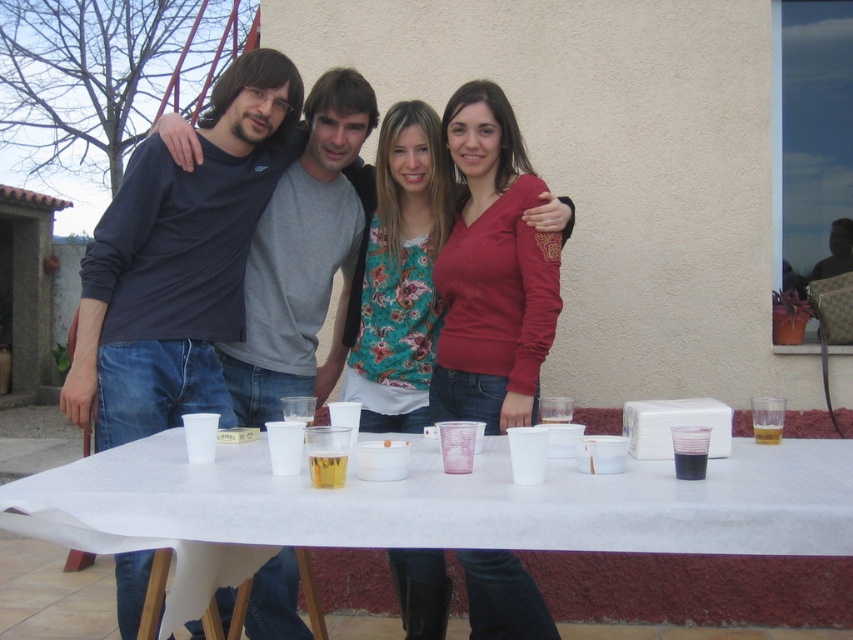
You are at a party and want to hand a drink to the person wearing the floral fabric shirt at center. You have a drink in a translucent plastic cup at center. Which direction should you move to reach them?

The floral fabric shirt at center is to the right of the translucent plastic cup at center, so you should move to your right to reach the person wearing the floral fabric shirt at center.

You are a photographer holding a camera that requires a minimum distance of 1.2 meters between the subject and the camera to focus properly. You want to take a photo of the white plastic table at center and the floral fabric shirt at center. Can you focus on both subjects at the same time?

The distance between the white plastic table at center and the floral fabric shirt at center is 1.07 meters, which is less than the required 1.2 meters. Therefore, the camera cannot focus on both subjects simultaneously.

You are at a party and want to grab the translucent plastic cup at center. To reach it, you need to move past the dark blue shirt at left. Is the cup in front of or behind the shirt?

The translucent plastic cup at center is behind the dark blue shirt at left, so you need to move around or behind the shirt to reach it.